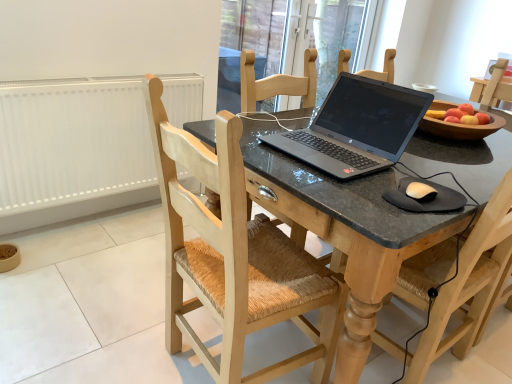
At what (x,y) coordinates should I click in order to perform the action: click on vacant area that is situated to the right of black rubber mousepad at lower right. Please return your answer as a coordinate pair (x, y). Looking at the image, I should click on (471, 190).